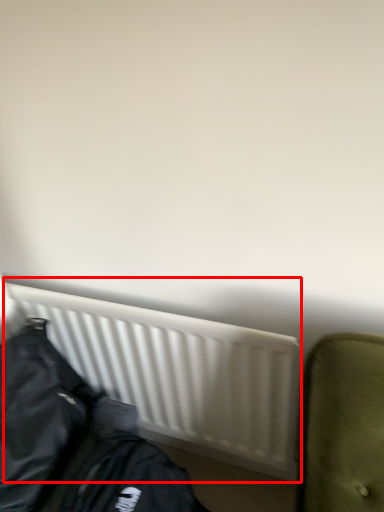
Question: From the image's perspective, where is radiator (annotated by the red box) located relative to jacket?

Choices:
 (A) below
 (B) above

Answer: (B)